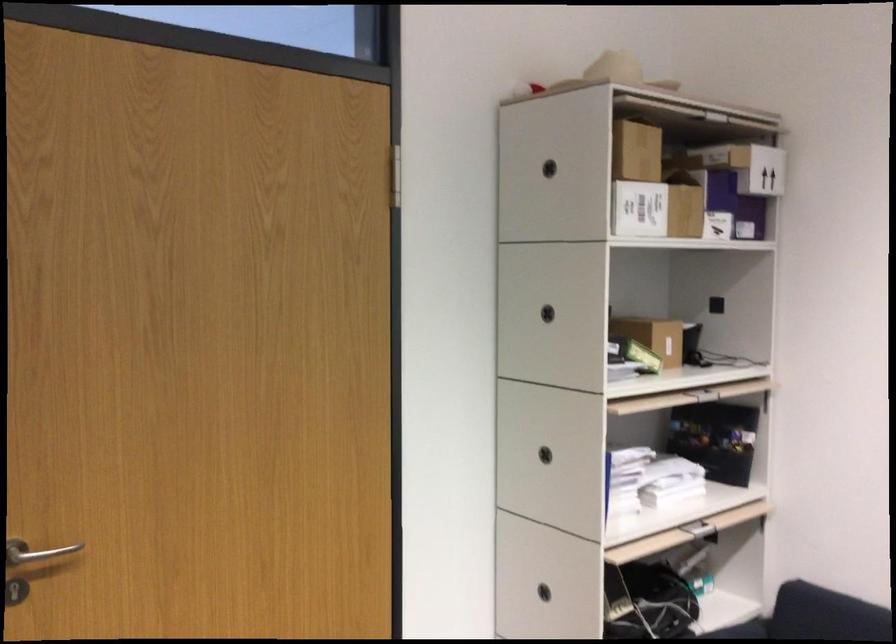
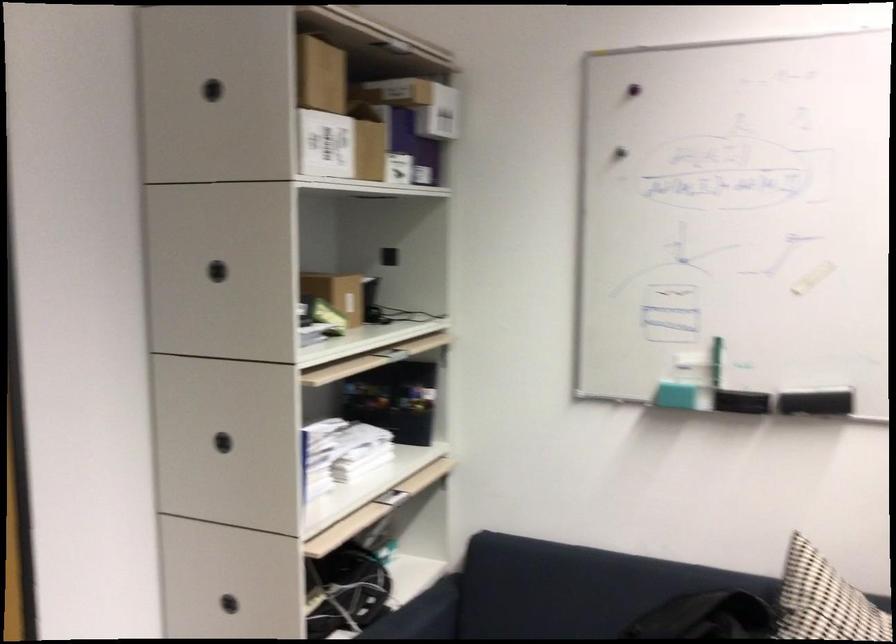
Find the pixel in the second image that matches the point at 719,223 in the first image.

(398, 167)